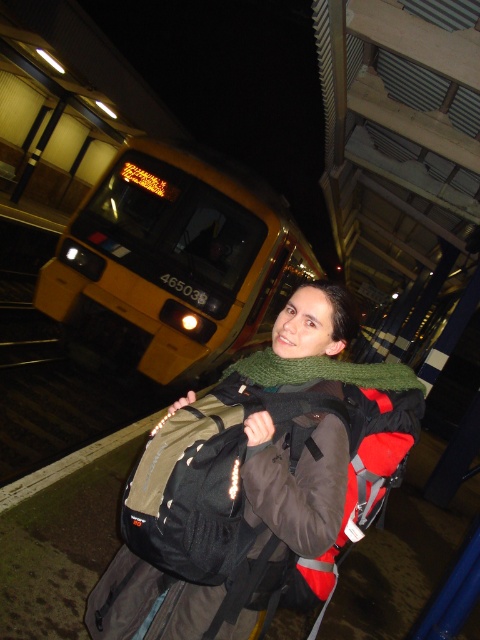
Between yellow matte train at upper left and green knitted scarf at center, which one is positioned higher?

yellow matte train at upper left is higher up.

Describe the element at coordinates (175, 260) in the screenshot. I see `yellow matte train at upper left` at that location.

You are a GUI agent. You are given a task and a screenshot of the screen. Output one action in this format:
    pyautogui.click(x=<x>, y=<y>)
    Task: Click on the yellow matte train at upper left
    Image resolution: width=480 pixels, height=640 pixels.
    Given the screenshot: What is the action you would take?
    click(x=175, y=260)